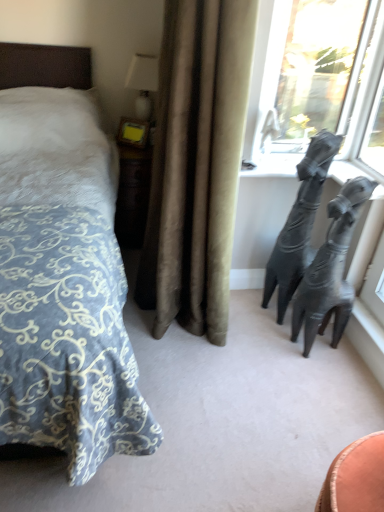
What are the coordinates of `vacant space positioned to the left of shiny metallic sculpture at right` in the screenshot? It's located at (268, 345).